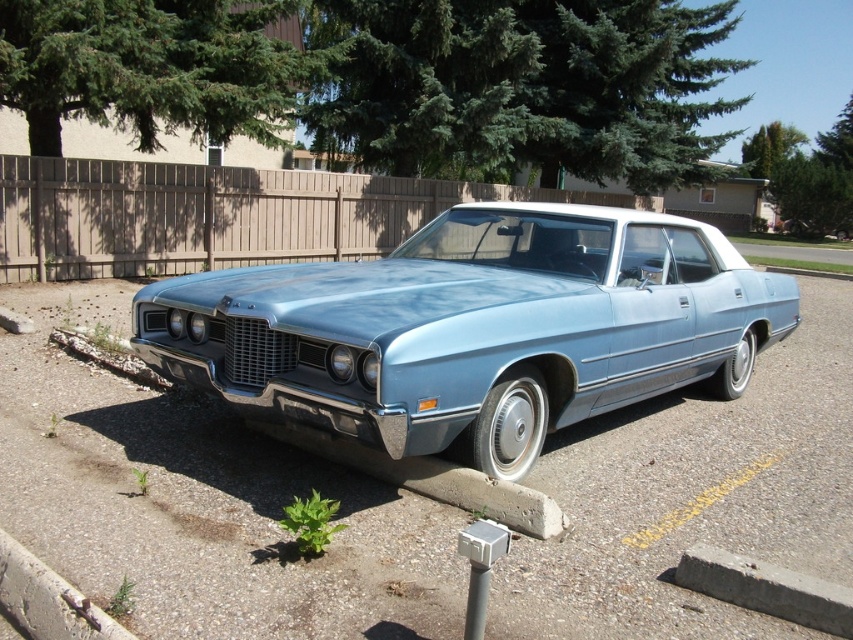
Question: Does metallic blue car at center have a smaller size compared to concrete at lower left?

Choices:
 (A) no
 (B) yes

Answer: (A)

Question: Which object is positioned closest to the light blue metallic car at center?

Choices:
 (A) concrete at lower left
 (B) metallic blue car at center

Answer: (A)

Question: Observing the image, what is the correct spatial positioning of metallic blue car at center in reference to light blue metallic car at center?

Choices:
 (A) above
 (B) below

Answer: (B)

Question: Which point is farther to the camera?

Choices:
 (A) light blue metallic car at center
 (B) concrete at lower left
 (C) metallic blue car at center

Answer: (A)

Question: Among these objects, which one is nearest to the camera?

Choices:
 (A) metallic blue car at center
 (B) light blue metallic car at center
 (C) concrete at lower left

Answer: (C)

Question: Observing the image, what is the correct spatial positioning of light blue metallic car at center in reference to concrete at lower left?

Choices:
 (A) below
 (B) above

Answer: (B)